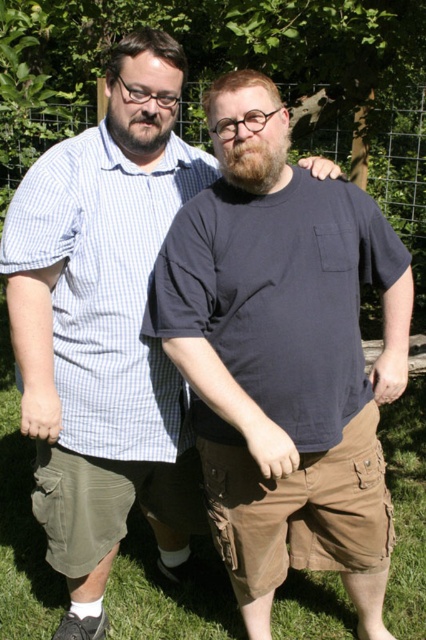
Which is in front, point (258, 193) or point (146, 628)?

Point (258, 193) is in front.

Who is higher up, dark blue cotton t-shirt at center or green grass at lower center?

dark blue cotton t-shirt at center

Identify the location of dark blue cotton t-shirt at center. This screenshot has height=640, width=426. pos(284,356).

Does dark blue cotton t-shirt at center appear on the left side of wire mesh fence at upper center?

Indeed, dark blue cotton t-shirt at center is positioned on the left side of wire mesh fence at upper center.

Does dark blue cotton t-shirt at center have a larger size compared to wire mesh fence at upper center?

Incorrect, dark blue cotton t-shirt at center is not larger than wire mesh fence at upper center.

Is point (348, 385) more distant than point (396, 112)?

No, it is in front of (396, 112).

Find the location of `dark blue cotton t-shirt at center`. dark blue cotton t-shirt at center is located at coordinates (284, 356).

Who is shorter, green grass at lower center or wire mesh fence at upper center?

Standing shorter between the two is green grass at lower center.

Measure the distance between point (411, 516) and camera.

A distance of 3.17 meters exists between point (411, 516) and camera.

Which is behind, point (40, 605) or point (397, 221)?

The point (397, 221) is behind.

At what (x,y) coordinates should I click in order to perform the action: click on green grass at lower center. Please return your answer as a coordinate pair (x, y). Image resolution: width=426 pixels, height=640 pixels. Looking at the image, I should click on (20, 524).